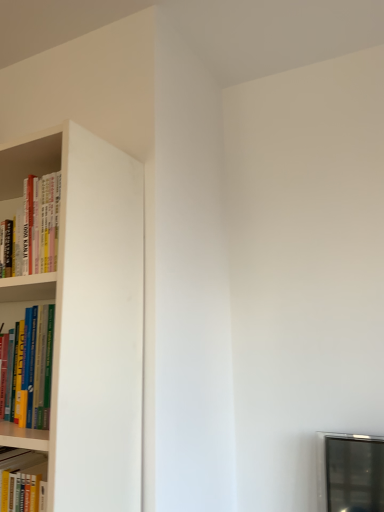
What do you see at coordinates (38, 364) in the screenshot? I see `hardcover books at left, arranged as the first book when ordered from the bottom` at bounding box center [38, 364].

Find the location of a particular element. hardcover books at left, arranged as the second book when viewed from the top is located at coordinates (38, 364).

Locate an element on the screen. The image size is (384, 512). hardcover books at left, the 1th book viewed from the top is located at coordinates (37, 227).

The image size is (384, 512). What do you see at coordinates (37, 227) in the screenshot?
I see `hardcover books at left, the first book positioned from the back` at bounding box center [37, 227].

The image size is (384, 512). In order to click on hardcover books at left, arranged as the first book when ordered from the bottom in this screenshot , I will do `click(38, 364)`.

Which object is positioned more to the left, hardcover books at left, the first book positioned from the back, or hardcover books at left, arranged as the second book when viewed from the top?

hardcover books at left, the first book positioned from the back, is more to the left.

Which object is closer to the camera taking this photo, hardcover books at left, the first book positioned from the back, or hardcover books at left, the 2th book in the back-to-front sequence?

hardcover books at left, the 2th book in the back-to-front sequence, is more forward.

Is point (26, 256) less distant than point (45, 384)?

No, it is behind (45, 384).

From the image's perspective, does hardcover books at left, the second book positioned from the bottom, appear lower than hardcover books at left, the 2th book in the back-to-front sequence?

Actually, hardcover books at left, the second book positioned from the bottom, appears above hardcover books at left, the 2th book in the back-to-front sequence, in the image.

From a real-world perspective, which object stands above the other?

hardcover books at left, the second book positioned from the bottom, from a real-world perspective.

Between hardcover books at left, the 1th book viewed from the top, and hardcover books at left, arranged as the first book when ordered from the bottom, which one has larger width?

hardcover books at left, the 1th book viewed from the top, is wider.

Considering the relative sizes of hardcover books at left, the first book positioned from the back, and hardcover books at left, the first book positioned from the front, in the image provided, is hardcover books at left, the first book positioned from the back, shorter than hardcover books at left, the first book positioned from the front,?

Yes, hardcover books at left, the first book positioned from the back, is shorter than hardcover books at left, the first book positioned from the front.

Which of these two, hardcover books at left, the second book positioned from the bottom, or hardcover books at left, arranged as the first book when ordered from the bottom, is smaller?

hardcover books at left, arranged as the first book when ordered from the bottom.

Is hardcover books at left, arranged as the second book when viewed from the top, inside hardcover books at left, the second book positioned from the bottom?

No, hardcover books at left, arranged as the second book when viewed from the top, is not surrounded by hardcover books at left, the second book positioned from the bottom.

Is hardcover books at left, which is counted as the 2th book, starting from the front, oriented away from hardcover books at left, the first book positioned from the front?

No, hardcover books at left, the first book positioned from the front, is not at the back of hardcover books at left, which is counted as the 2th book, starting from the front.

How far apart are hardcover books at left, the second book positioned from the bottom, and hardcover books at left, arranged as the first book when ordered from the bottom?

7.70 inches.

Locate an element on the screen. The image size is (384, 512). book beneath the hardcover books at left, the second book positioned from the bottom (from a real-world perspective) is located at coordinates (38, 364).

Considering the relative positions of hardcover books at left, the 2th book in the back-to-front sequence, and hardcover books at left, the first book positioned from the back, in the image provided, is hardcover books at left, the 2th book in the back-to-front sequence, to the right of hardcover books at left, the first book positioned from the back, from the viewer's perspective?

Correct, you'll find hardcover books at left, the 2th book in the back-to-front sequence, to the right of hardcover books at left, the first book positioned from the back.

Is hardcover books at left, the 2th book in the back-to-front sequence, positioned before hardcover books at left, the first book positioned from the back?

Yes, it is in front of hardcover books at left, the first book positioned from the back.

Is point (30, 392) farther from viewer compared to point (57, 219)?

That is False.

From the image's perspective, which is above, hardcover books at left, the first book positioned from the front, or hardcover books at left, which is counted as the 2th book, starting from the front?

hardcover books at left, which is counted as the 2th book, starting from the front, is shown above in the image.

From a real-world perspective, is hardcover books at left, arranged as the second book when viewed from the top, over hardcover books at left, the 1th book viewed from the top?

No, from a real-world perspective, hardcover books at left, arranged as the second book when viewed from the top, is not on top of hardcover books at left, the 1th book viewed from the top.

Which of these two, hardcover books at left, arranged as the first book when ordered from the bottom, or hardcover books at left, which is counted as the 2th book, starting from the front, is thinner?

hardcover books at left, arranged as the first book when ordered from the bottom, is thinner.

Considering the relative sizes of hardcover books at left, the 2th book in the back-to-front sequence, and hardcover books at left, the first book positioned from the back, in the image provided, is hardcover books at left, the 2th book in the back-to-front sequence, taller than hardcover books at left, the first book positioned from the back,?

Correct, hardcover books at left, the 2th book in the back-to-front sequence, is much taller as hardcover books at left, the first book positioned from the back.

Considering the relative sizes of hardcover books at left, the first book positioned from the front, and hardcover books at left, which is counted as the 2th book, starting from the front, in the image provided, is hardcover books at left, the first book positioned from the front, bigger than hardcover books at left, which is counted as the 2th book, starting from the front,?

No.

Is hardcover books at left, which is counted as the 2th book, starting from the front, surrounded by hardcover books at left, arranged as the first book when ordered from the bottom?

No.

Are hardcover books at left, the 2th book in the back-to-front sequence, and hardcover books at left, the first book positioned from the back, located far from each other?

No, hardcover books at left, the 2th book in the back-to-front sequence, is not far from hardcover books at left, the first book positioned from the back.

Is hardcover books at left, arranged as the second book when viewed from the top, turned away from hardcover books at left, the 1th book viewed from the top?

hardcover books at left, arranged as the second book when viewed from the top, is not turned away from hardcover books at left, the 1th book viewed from the top.

Can you tell me how much hardcover books at left, arranged as the second book when viewed from the top, and hardcover books at left, which is counted as the 2th book, starting from the front, differ in facing direction?

0.161 degrees.

In the scene shown: How distant is hardcover books at left, the first book positioned from the front, from hardcover books at left, the first book positioned from the back?

The distance of hardcover books at left, the first book positioned from the front, from hardcover books at left, the first book positioned from the back, is 7.70 inches.

In the image, there is a hardcover books at left, the 1th book viewed from the top. Where is `book below it (from a real-world perspective)`? book below it (from a real-world perspective) is located at coordinates (38, 364).

I want to click on book that appears below the hardcover books at left, the 1th book viewed from the top (from a real-world perspective), so click(38, 364).

In the image, there is a hardcover books at left, which is counted as the 2th book, starting from the front. At what (x,y) coordinates should I click in order to perform the action: click on book below it (from the image's perspective). Please return your answer as a coordinate pair (x, y). The height and width of the screenshot is (512, 384). Looking at the image, I should click on coord(38,364).